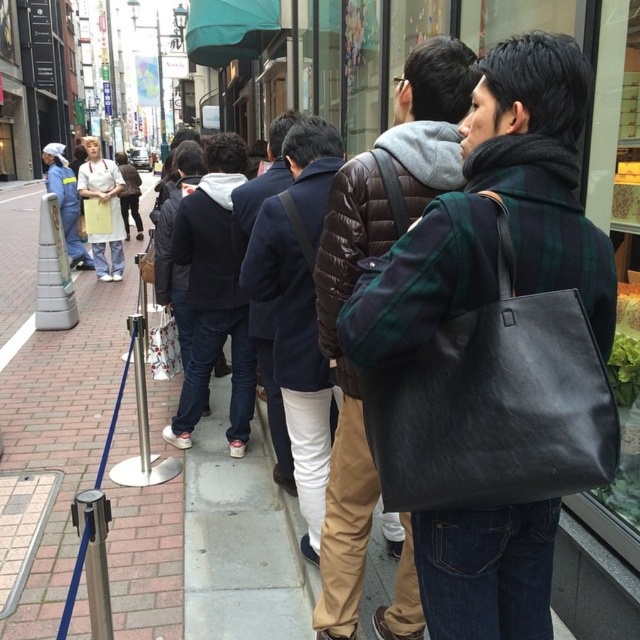
You are a delivery robot with a width of 0.8 meters. You need to navigate through the space between the green plaid coat at center and the camera. Is there enough space for you to pass through?

The distance between the green plaid coat at center and the camera is 1.18 meters. Since the robot is 0.8 meters wide, there is sufficient space for it to pass through as the distance is greater than the robot width.

You are standing on the sidewalk in the scene and want to take a photo of both the man in the green and black checkered jacket and the blue rope barrier. Which point, point (548,140) or point (298,346), is closer to your camera when focusing on the man?

Point (548,140) is closer to the camera than point (298,346), so it is the closer point when focusing on the man.